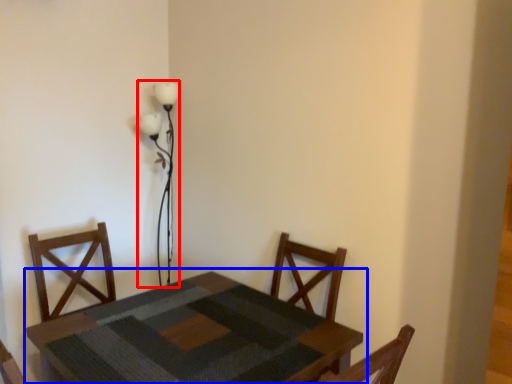
Question: Which point is closer to the camera, table lamp (highlighted by a red box) or table (highlighted by a blue box)?

Choices:
 (A) table lamp
 (B) table

Answer: (B)